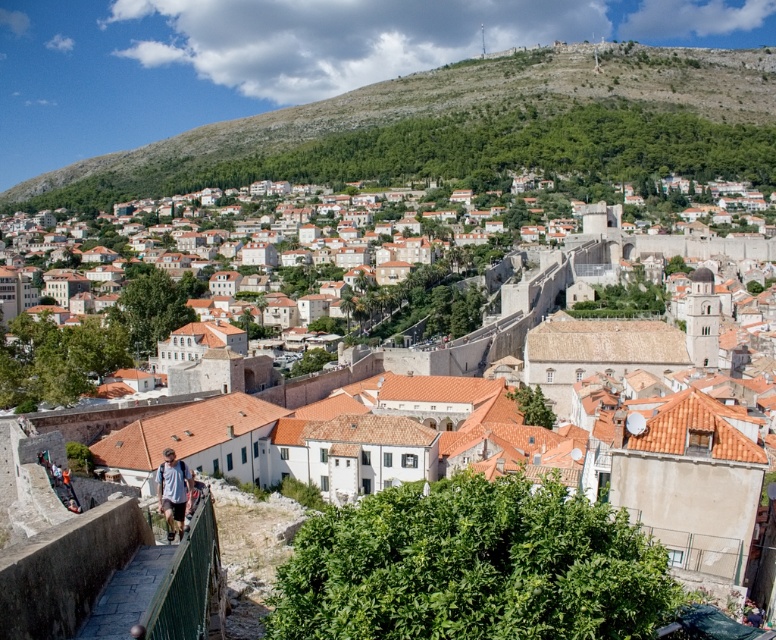
You are a drone operator tasked with capturing aerial footage of the historic walled city. Your drone is currently hovering above the green textured hillside at upper center. You need to fly it to the light blue denim jeans at lower left. Considering the drone has a maximum flight range of 300 meters, will it be able to reach the destination without needing a recharge?

The distance between the green textured hillside at upper center and the light blue denim jeans at lower left is 278.54 meters. Since the drone has a maximum flight range of 300 meters, it can reach the destination without needing a recharge as the required distance is within its operational limit.

You are standing at the base of the green textured hillside at upper center and want to walk to the light blue denim jeans at lower left. Which direction should you head?

Since the green textured hillside at upper center is closer to you than the light blue denim jeans at lower left, you should head downward towards the lower left direction to reach the light blue denim jeans at lower left.

You are standing at the point marked as point (470, 128) in the image. Looking around, you see the historic walled city with ancient stone walls and a dense urban landscape with terracotta roofs. What type of terrain are you currently standing on?

You are standing on a green textured hillside at upper center.